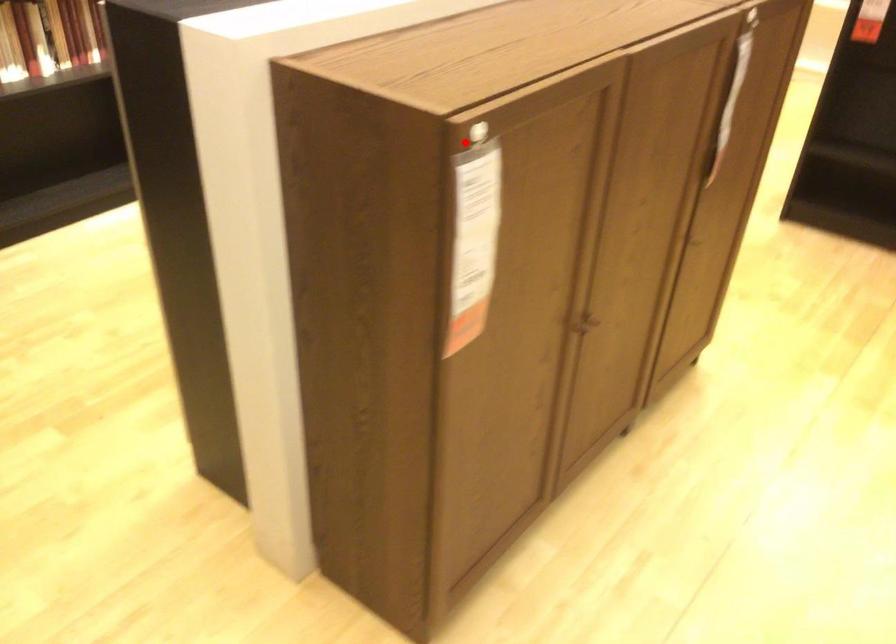
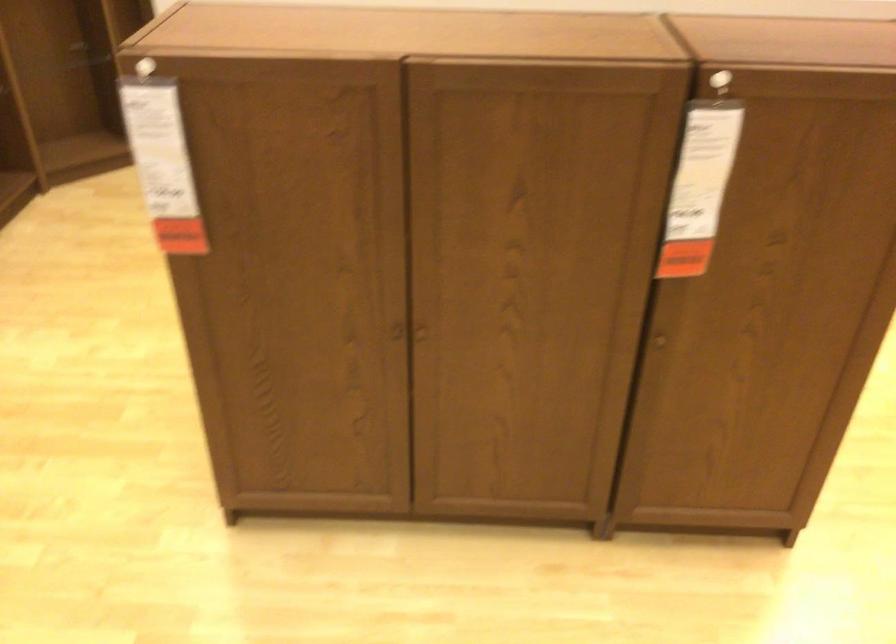
Question: I am providing you with two images of the same scene from different viewpoints. Given a red point in image1, look at the same physical point in image2. Is it:

Choices:
 (A) Closer to the viewpoint
 (B) Farther from the viewpoint

Answer: (B)